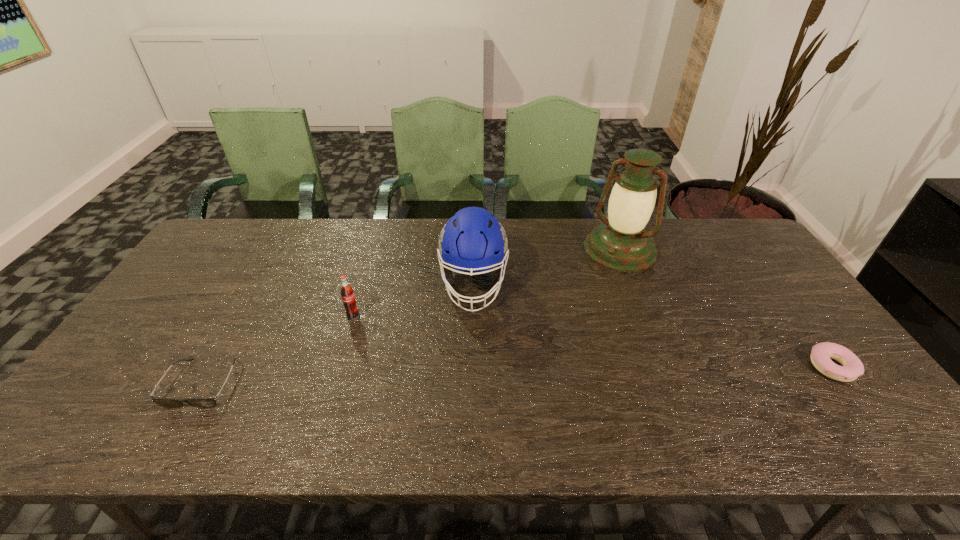
What are the coordinates of `vacant space located 0.370m on the label of the soda bottle` in the screenshot? It's located at (468, 376).

At what (x,y) coordinates should I click in order to perform the action: click on vacant space located 0.170m on the label of the soda bottle. Please return your answer as a coordinate pair (x, y). Looking at the image, I should click on (405, 343).

Find the location of a particular element. The height and width of the screenshot is (540, 960). vacant area situated with the light compartment facing forward on the lantern is located at coordinates (556, 328).

Where is `vacant area situated 0.310m with the light compartment facing forward on the lantern`? vacant area situated 0.310m with the light compartment facing forward on the lantern is located at coordinates (558, 326).

At what (x,y) coordinates should I click in order to perform the action: click on vacant space located 0.260m with the light compartment facing forward on the lantern. Please return your answer as a coordinate pair (x, y). The height and width of the screenshot is (540, 960). Looking at the image, I should click on (566, 315).

In order to click on vacant space located on the face guard of the fourth shortest object in this screenshot , I will do `click(470, 355)`.

Where is `vacant space located on the face guard of the fourth shortest object`? vacant space located on the face guard of the fourth shortest object is located at coordinates (469, 371).

Identify the location of free location located on the face guard of the fourth shortest object. click(x=468, y=395).

Find the location of `lantern that is at the far edge`. lantern that is at the far edge is located at coordinates (621, 243).

Where is `football helmet that is at the far edge`? football helmet that is at the far edge is located at coordinates (473, 240).